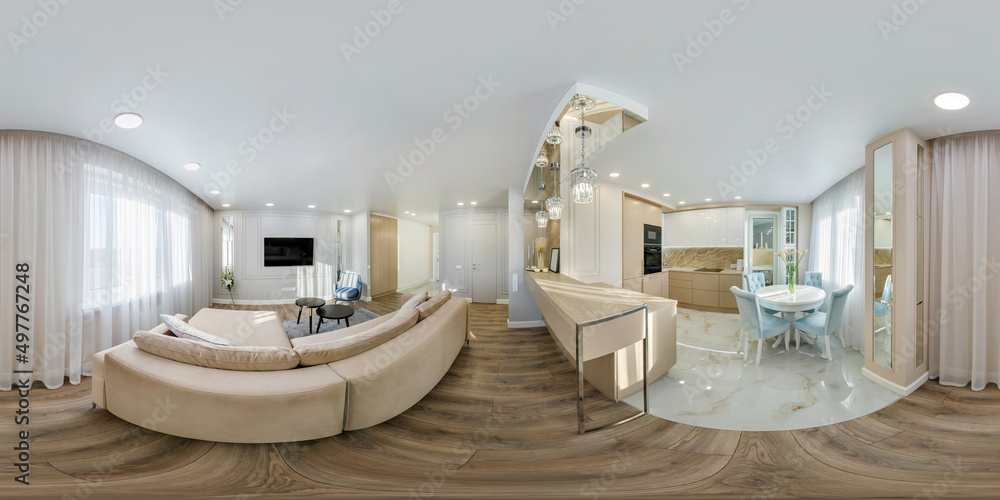
Identify the location of microwave. (652, 236).